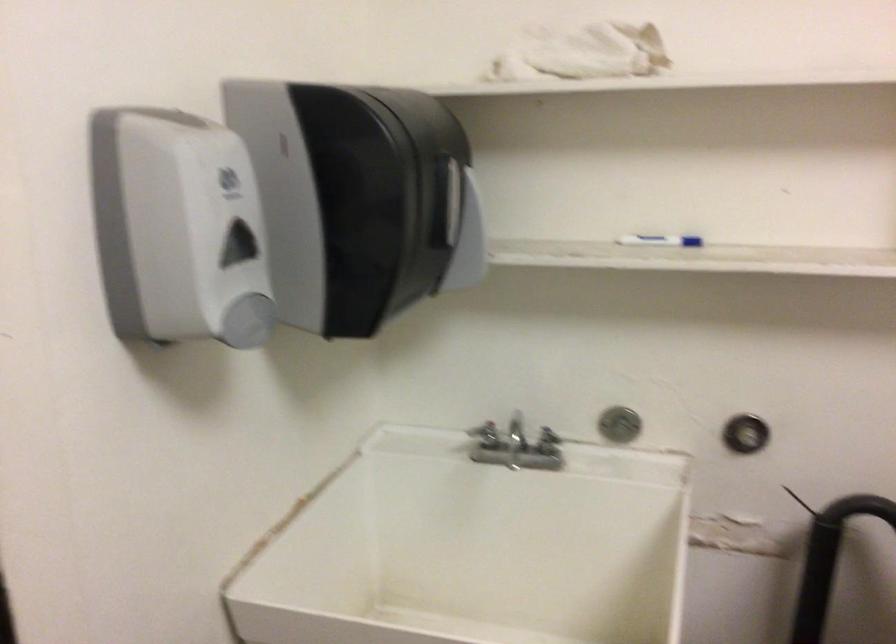
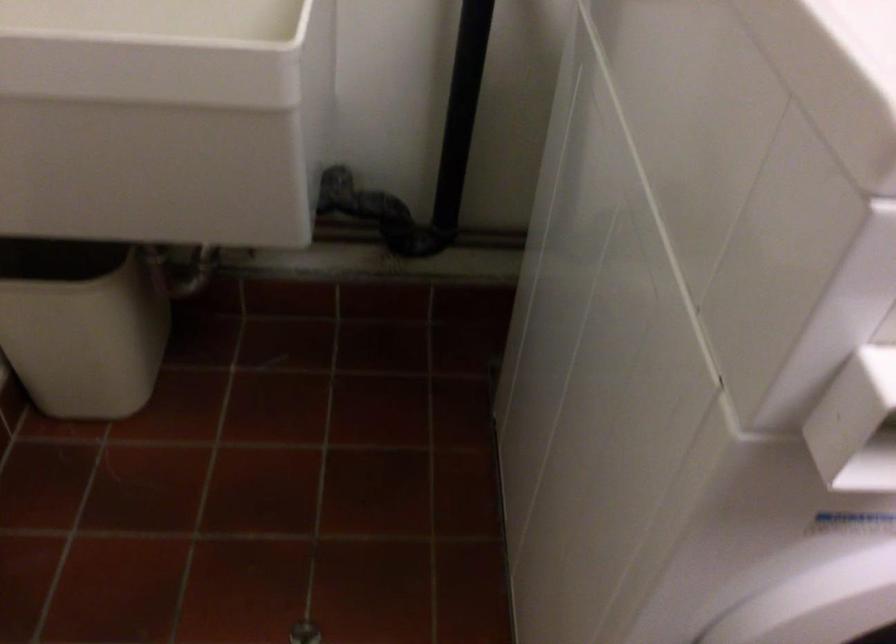
Based on the continuous images, in which direction is the camera rotating?

The rotation direction of the camera is right-down.